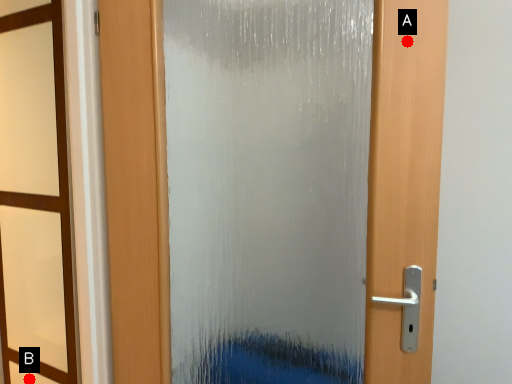
Question: Two points are circled on the image, labeled by A and B beside each circle. Which point is closer to the camera?

Choices:
 (A) A is closer
 (B) B is closer

Answer: (A)